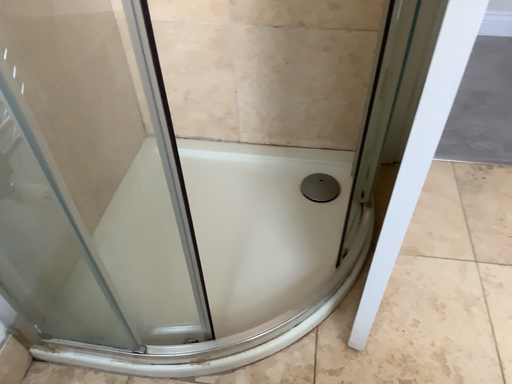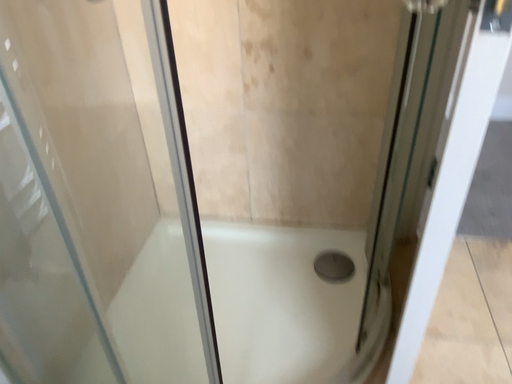
Question: How did the camera likely rotate when shooting the video?

Choices:
 (A) rotated upward
 (B) rotated downward

Answer: (A)